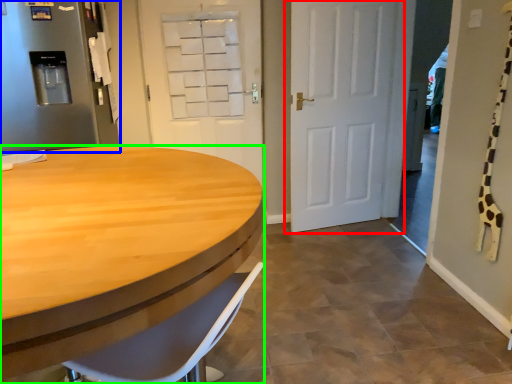
Question: Which object is the farthest from door (highlighted by a red box)? Choose among these: refrigerator (highlighted by a blue box) or desk (highlighted by a green box).

Choices:
 (A) refrigerator
 (B) desk

Answer: (B)